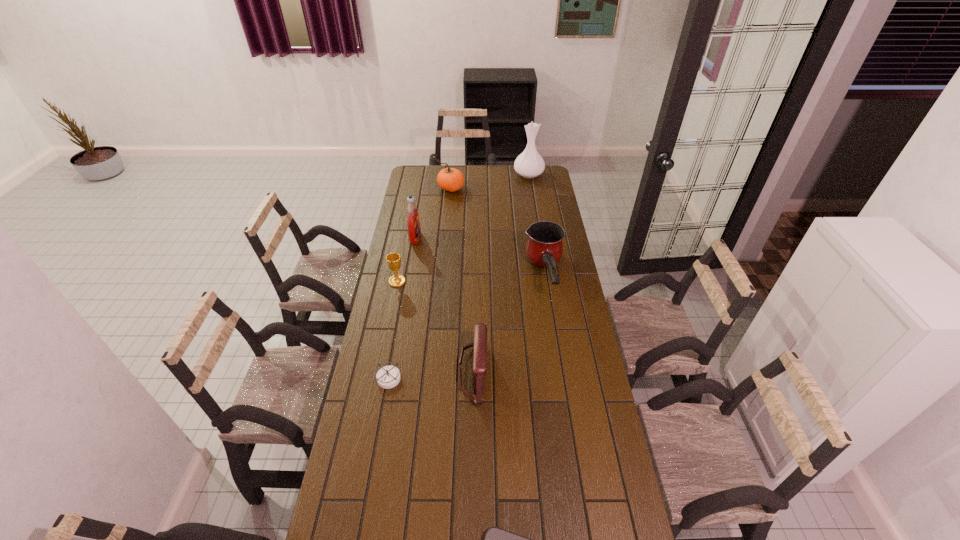
The width and height of the screenshot is (960, 540). I want to click on saucepan that is positioned at the right edge, so click(x=544, y=248).

Where is `object present at the far right corner`? The width and height of the screenshot is (960, 540). object present at the far right corner is located at coordinates (529, 164).

You are a GUI agent. You are given a task and a screenshot of the screen. Output one action in this format:
    pyautogui.click(x=<x>, y=<y>)
    Task: Click on the free space at the left edge of the desktop
    The image size is (960, 540).
    Given the screenshot: What is the action you would take?
    pyautogui.click(x=374, y=341)

Locate an element on the screen. The image size is (960, 540). vacant space at the right edge of the desktop is located at coordinates (588, 471).

Identify the location of vacant region at the far left corner. (418, 172).

Locate an element on the screen. The width and height of the screenshot is (960, 540). vacant space at the far right corner of the desktop is located at coordinates (540, 178).

This screenshot has width=960, height=540. Find the location of `vacant area that lies between the sixth nearest object and the compass`. vacant area that lies between the sixth nearest object and the compass is located at coordinates (402, 307).

Locate an element on the screen. This screenshot has width=960, height=540. free area in between the compass and the pumpkin is located at coordinates (420, 283).

Where is `vacant area between the compass and the pumpkin`? The height and width of the screenshot is (540, 960). vacant area between the compass and the pumpkin is located at coordinates (420, 283).

Where is `free space between the shoulder bag and the tallest object`? This screenshot has height=540, width=960. free space between the shoulder bag and the tallest object is located at coordinates (501, 273).